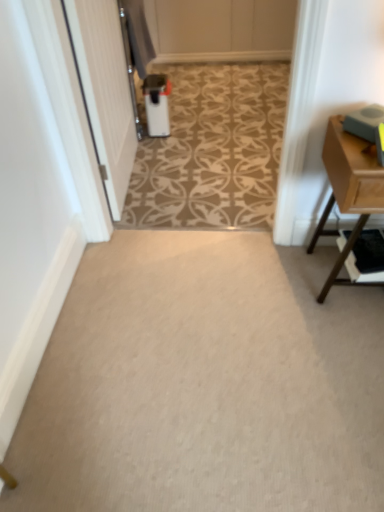
Question: Does light brown wood table at right have a lesser width compared to white glossy trash can at center?

Choices:
 (A) yes
 (B) no

Answer: (A)

Question: Is light brown wood table at right at the left side of white glossy trash can at center?

Choices:
 (A) yes
 (B) no

Answer: (B)

Question: Are light brown wood table at right and white glossy trash can at center far apart?

Choices:
 (A) yes
 (B) no

Answer: (A)

Question: From the image's perspective, does light brown wood table at right appear lower than white glossy trash can at center?

Choices:
 (A) yes
 (B) no

Answer: (A)

Question: Does light brown wood table at right have a greater height compared to white glossy trash can at center?

Choices:
 (A) yes
 (B) no

Answer: (A)

Question: From a real-world perspective, is wooden shelf at right positioned above or below carpet at center?

Choices:
 (A) above
 (B) below

Answer: (A)

Question: Is wooden shelf at right taller or shorter than carpet at center?

Choices:
 (A) tall
 (B) short

Answer: (A)

Question: In the image, is wooden shelf at right positioned in front of or behind carpet at center?

Choices:
 (A) front
 (B) behind

Answer: (B)

Question: Would you say wooden shelf at right is inside or outside carpet at center?

Choices:
 (A) outside
 (B) inside

Answer: (A)

Question: Considering their positions, is carpet at center located in front of or behind wooden shelf at right?

Choices:
 (A) front
 (B) behind

Answer: (A)

Question: Visually, is carpet at center positioned to the left or to the right of wooden shelf at right?

Choices:
 (A) left
 (B) right

Answer: (A)

Question: Considering the positions of carpet at center and wooden shelf at right in the image, is carpet at center bigger or smaller than wooden shelf at right?

Choices:
 (A) small
 (B) big

Answer: (B)

Question: Does point (11, 444) appear closer or farther from the camera than point (380, 246)?

Choices:
 (A) closer
 (B) farther

Answer: (A)

Question: From the image's perspective, is carpet at center above or below white glossy trash can at center?

Choices:
 (A) below
 (B) above

Answer: (A)

Question: From a real-world perspective, relative to white glossy trash can at center, is carpet at center vertically above or below?

Choices:
 (A) below
 (B) above

Answer: (A)